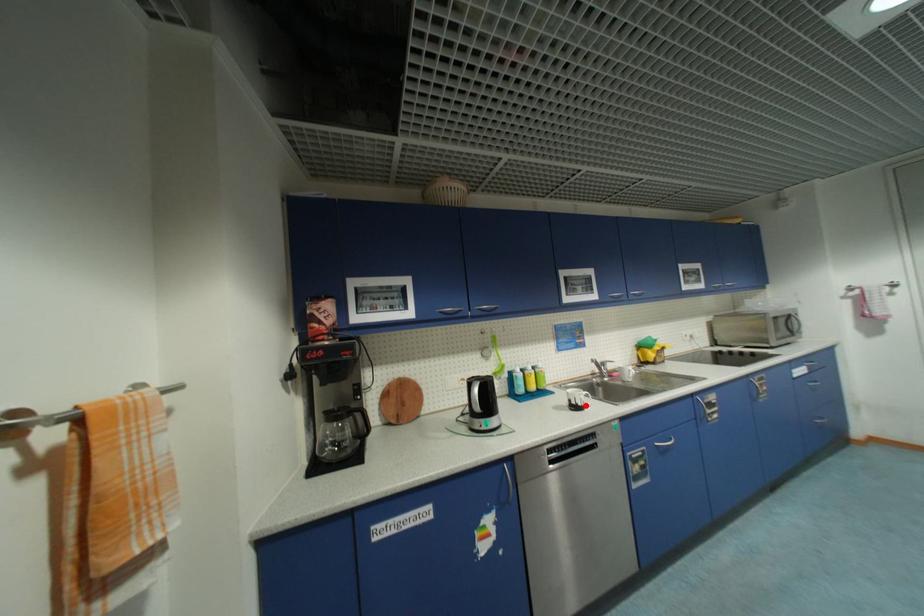
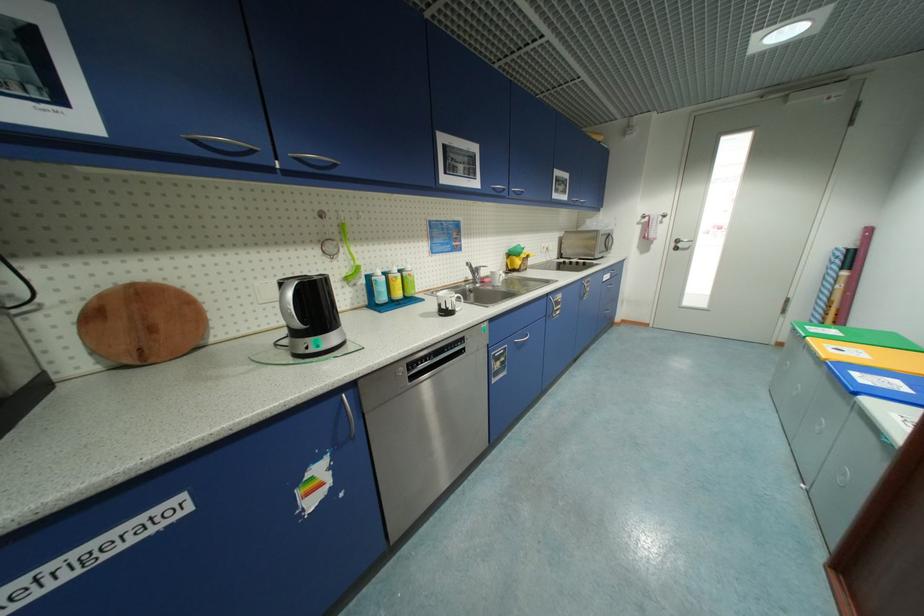
In the second image, find the point that corresponds to the highlighted location in the first image.

(456, 310)